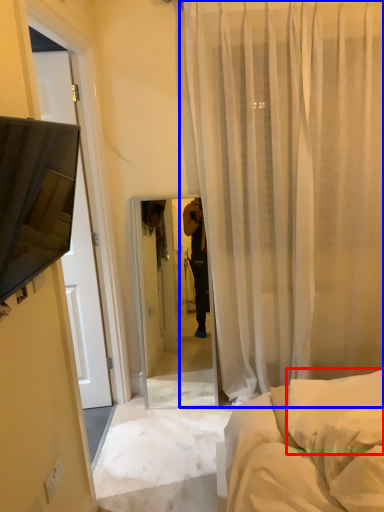
Question: Which object is further to the camera taking this photo, pillow (highlighted by a red box) or curtain (highlighted by a blue box)?

Choices:
 (A) pillow
 (B) curtain

Answer: (B)